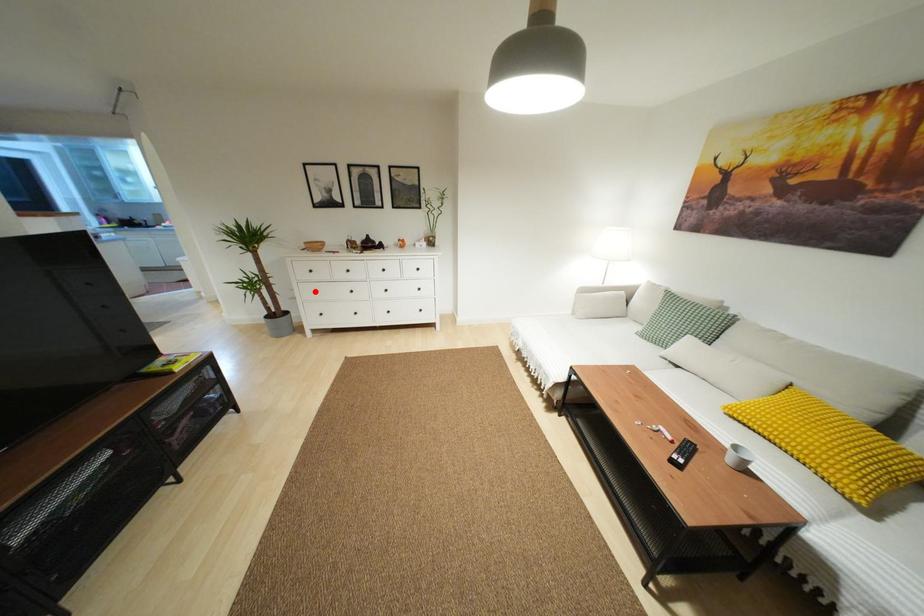
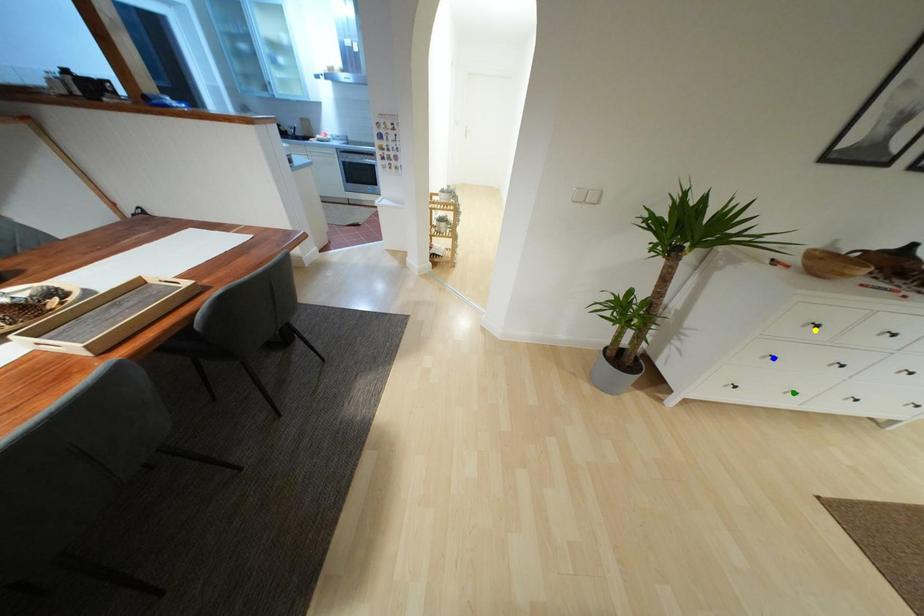
Question: I am providing you with two images of the same scene from different viewpoints. A red point is marked on the first image. You are given multiple points on the second image. In image 2, which mark is for the same physical point as the one in image 1?

Choices:
 (A) green point
 (B) yellow point
 (C) blue point

Answer: (C)